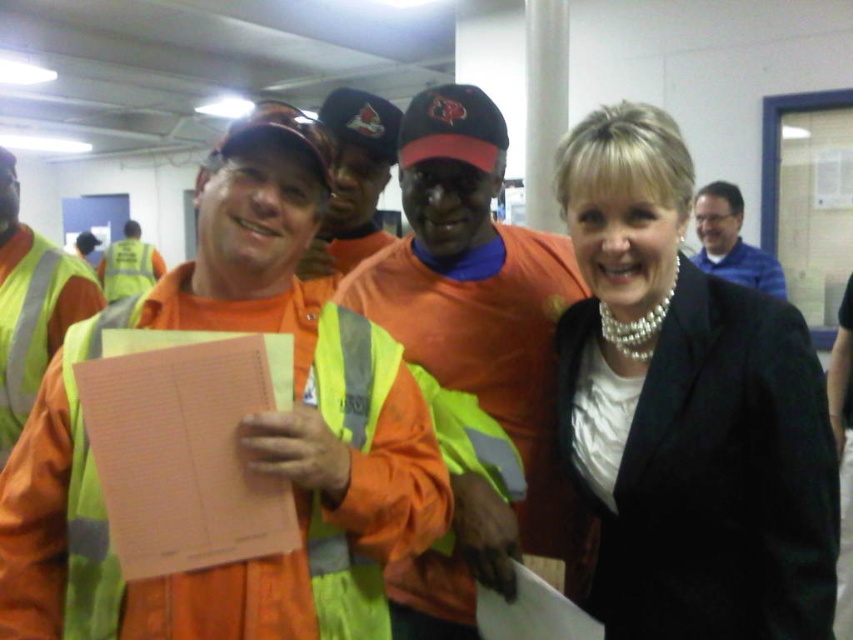
Does orange reflective vest at left appear on the left side of orange fabric cap at center?

Indeed, orange reflective vest at left is positioned on the left side of orange fabric cap at center.

Does orange reflective vest at left appear over orange fabric cap at center?

No.

Is point (9, 289) farther from viewer compared to point (383, 100)?

No.

Identify the location of orange reflective vest at left. (32, 305).

Which of these two, yellow reflective safety vest at left or blue shirt at upper right, stands shorter?

yellow reflective safety vest at left is shorter.

Which is in front, point (334, 525) or point (694, 262)?

Positioned in front is point (334, 525).

Image resolution: width=853 pixels, height=640 pixels. What are the coordinates of `yellow reflective safety vest at left` in the screenshot? It's located at (352, 483).

Does pearl necklace at upper right have a larger size compared to pink paper clipboard at left?

Yes, pearl necklace at upper right is bigger than pink paper clipboard at left.

Can you confirm if pearl necklace at upper right is positioned to the left of pink paper clipboard at left?

No, pearl necklace at upper right is not to the left of pink paper clipboard at left.

Is point (663, 506) farther from camera compared to point (135, 566)?

Yes, point (663, 506) is farther from viewer.

At what (x,y) coordinates should I click in order to perform the action: click on pearl necklace at upper right. Please return your answer as a coordinate pair (x, y). This screenshot has height=640, width=853. Looking at the image, I should click on (686, 410).